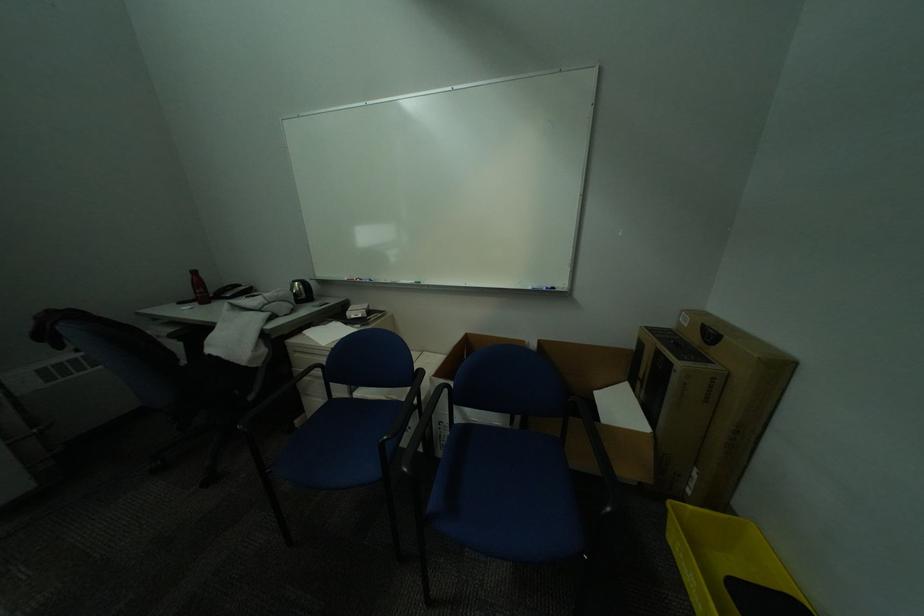
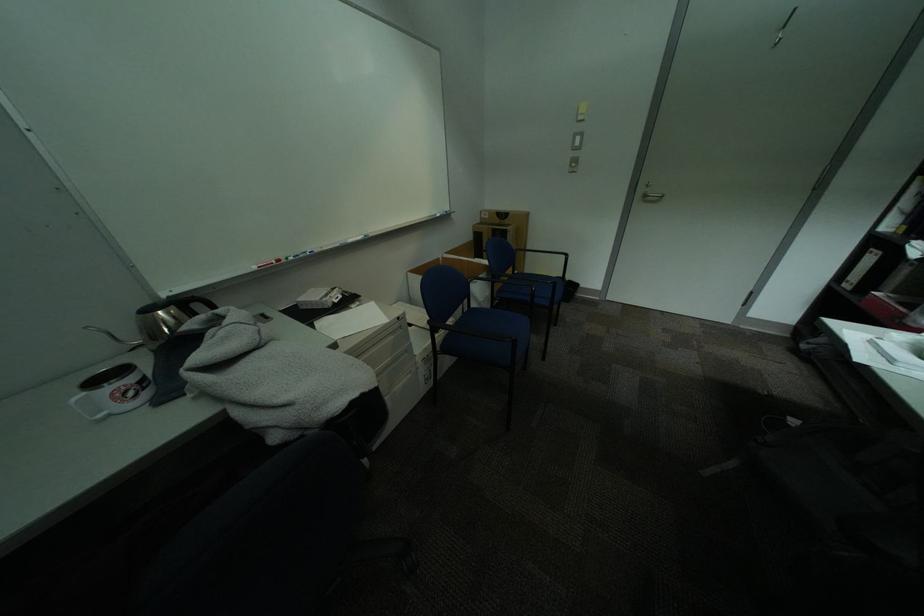
Find the pixel in the second image that matches point 657,329 in the first image.

(487, 225)